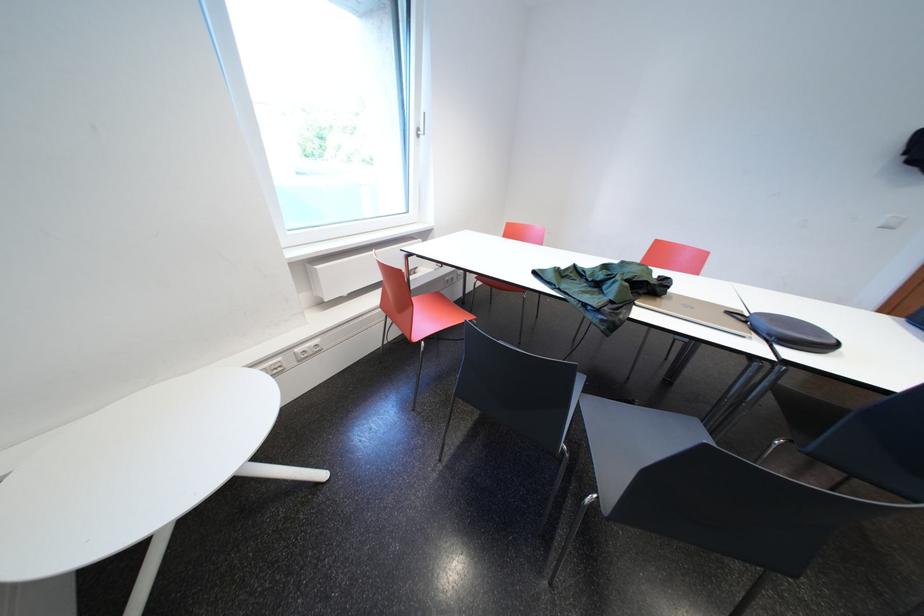
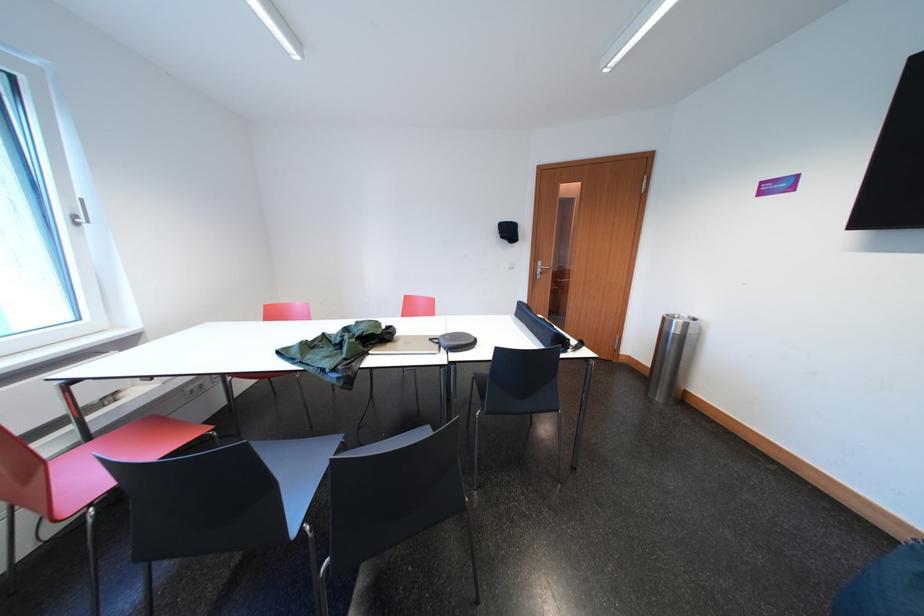
The point at (667, 294) is marked in the first image. Where is the corresponding point in the second image?

(395, 341)